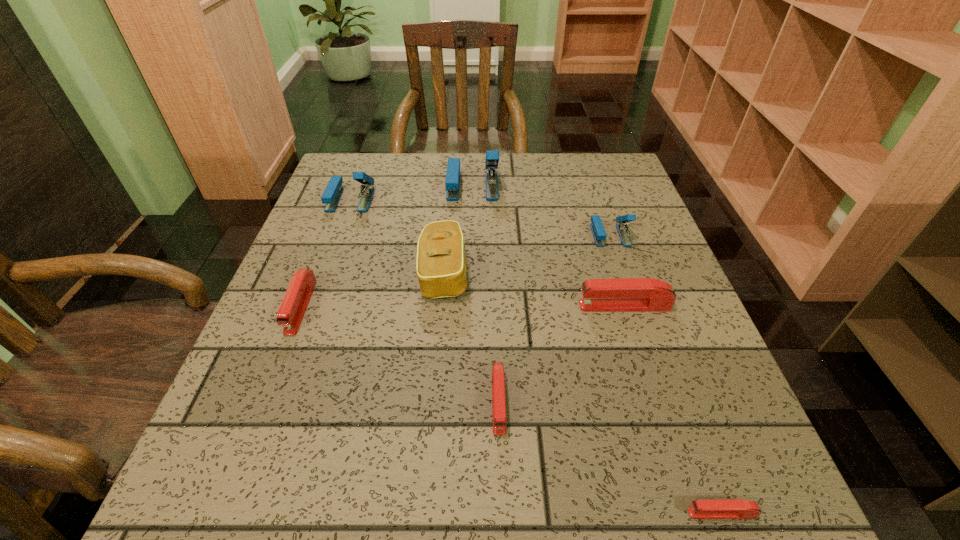
Where is `vacant space that is in between the tallest object and the leftmost blue stapler`? The image size is (960, 540). vacant space that is in between the tallest object and the leftmost blue stapler is located at coordinates (412, 192).

In order to click on vacant space that's between the nearest object and the third red stapler from right to left in this screenshot , I will do `click(610, 457)`.

At what (x,y) coordinates should I click in order to perform the action: click on empty space between the third shortest object and the smallest red stapler. Please return your answer as a coordinate pair (x, y). Image resolution: width=960 pixels, height=540 pixels. Looking at the image, I should click on (512, 410).

Point out which object is positioned as the seventh nearest to the brown clutch bag. Please provide its 2D coordinates. Your answer should be formatted as a tuple, i.e. [(x, y)], where the tuple contains the x and y coordinates of a point satisfying the conditions above.

[(734, 508)]

Locate an element on the screen. the fifth closest object relative to the biggest red stapler is located at coordinates (452, 183).

You are a GUI agent. You are given a task and a screenshot of the screen. Output one action in this format:
    pyautogui.click(x=<x>, y=<y>)
    Task: Click on the stapler that stands as the second closest to the smallest blue stapler
    The width and height of the screenshot is (960, 540).
    Given the screenshot: What is the action you would take?
    pyautogui.click(x=452, y=183)

Identify which stapler is the third closest to the sixth tallest stapler. Please provide its 2D coordinates. Your answer should be formatted as a tuple, i.e. [(x, y)], where the tuple contains the x and y coordinates of a point satisfying the conditions above.

[(292, 309)]

Locate which blue stapler ranks in proximity to the nearest object. Please provide its 2D coordinates. Your answer should be formatted as a tuple, i.e. [(x, y)], where the tuple contains the x and y coordinates of a point satisfying the conditions above.

[(597, 228)]

This screenshot has width=960, height=540. I want to click on blue stapler that is the closest to the clutch bag, so click(452, 183).

This screenshot has width=960, height=540. I want to click on red stapler that can be found as the closest to the tallest stapler, so click(x=622, y=294).